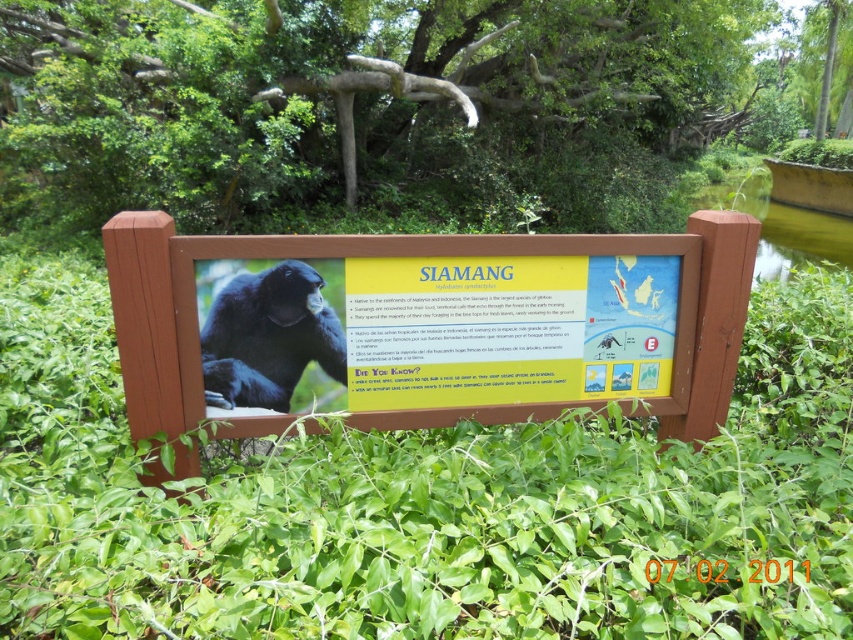
Question: Is wooden signboard at center to the right of shiny black siamang at center from the viewer's perspective?

Choices:
 (A) yes
 (B) no

Answer: (A)

Question: Estimate the real-world distances between objects in this image. Which object is closer to the green leafy plant at center?

Choices:
 (A) wooden signboard at center
 (B) shiny black siamang at center

Answer: (B)

Question: Based on their relative distances, which object is nearer to the shiny black siamang at center?

Choices:
 (A) wooden signboard at center
 (B) green leafy plant at center

Answer: (A)

Question: Is green leafy plant at center wider than shiny black siamang at center?

Choices:
 (A) yes
 (B) no

Answer: (A)

Question: Does green leafy plant at center appear on the right side of wooden signboard at center?

Choices:
 (A) no
 (B) yes

Answer: (A)

Question: Which point is closer to the camera taking this photo?

Choices:
 (A) (711, 376)
 (B) (187, 532)
 (C) (215, 308)

Answer: (B)